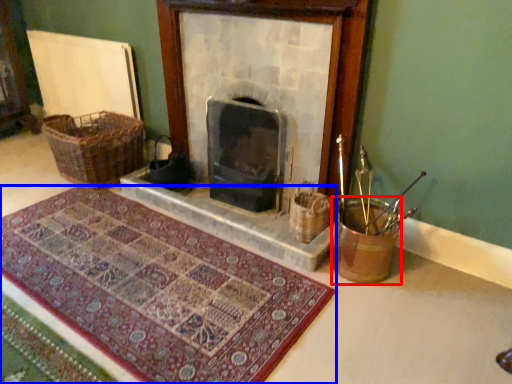
Question: Which object appears closest to the camera in this image, basket container (highlighted by a red box) or mat (highlighted by a blue box)?

Choices:
 (A) basket container
 (B) mat

Answer: (B)